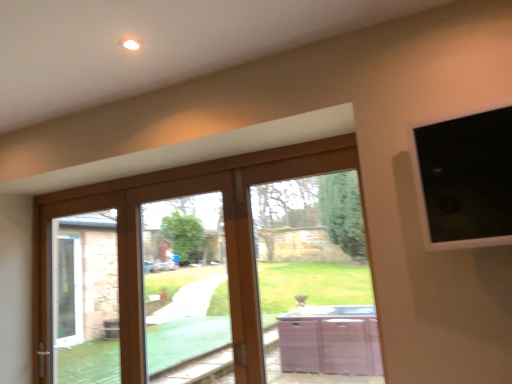
Question: Is clear glass door at center inside or outside of wooden glass door at center?

Choices:
 (A) outside
 (B) inside

Answer: (B)

Question: From the image's perspective, relative to wooden glass door at center, is clear glass door at center above or below?

Choices:
 (A) below
 (B) above

Answer: (B)

Question: Estimate the real-world distances between objects in this image. Which object is closer to the brown wooden bay window at center?

Choices:
 (A) clear glass door at center
 (B) wooden glass door at center
 (C) black glass at upper right

Answer: (B)

Question: Which object is positioned closest to the wooden glass door at center?

Choices:
 (A) black glass at upper right
 (B) clear glass door at center
 (C) brown wooden bay window at center

Answer: (C)